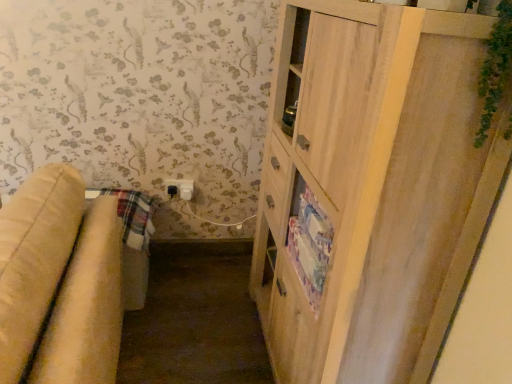
Question: Visually, is beige fabric studio couch at left positioned to the left or to the right of light wood cabinet at right?

Choices:
 (A) left
 (B) right

Answer: (A)

Question: From the image's perspective, relative to light wood cabinet at right, is beige fabric studio couch at left above or below?

Choices:
 (A) below
 (B) above

Answer: (A)

Question: Which object is the farthest from the light wood cabinet at right?

Choices:
 (A) white plastic electric outlet at lower center
 (B) beige fabric studio couch at left

Answer: (A)

Question: Which of these objects is positioned farthest from the white plastic electric outlet at lower center?

Choices:
 (A) beige fabric studio couch at left
 (B) light wood cabinet at right

Answer: (B)